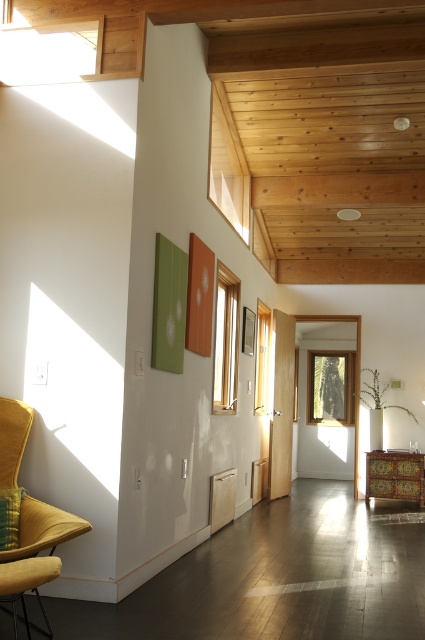
Question: Does vividly painted wooden cabinet at center appear on the right side of velvet yellow pillow at left?

Choices:
 (A) no
 (B) yes

Answer: (B)

Question: Is velvet yellow armchair at left to the left of velvet yellow pillow at left from the viewer's perspective?

Choices:
 (A) no
 (B) yes

Answer: (A)

Question: From the image, what is the correct spatial relationship of velvet yellow armchair at left in relation to velvet yellow pillow at left?

Choices:
 (A) below
 (B) above

Answer: (B)

Question: Which object is positioned farthest from the velvet yellow pillow at left?

Choices:
 (A) vividly painted wooden cabinet at center
 (B) velvet yellow armchair at left

Answer: (A)

Question: Which of the following is the closest to the observer?

Choices:
 (A) (2, 496)
 (B) (379, 481)
 (C) (6, 561)

Answer: (C)

Question: Which point is farther from the camera taking this photo?

Choices:
 (A) (374, 451)
 (B) (82, 529)

Answer: (A)